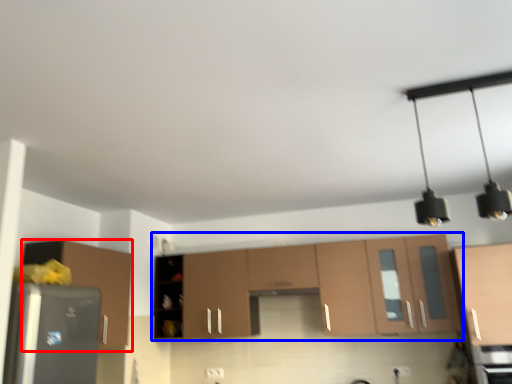
Question: Which point is closer to the camera, cabinetry (highlighted by a red box) or cabinetry (highlighted by a blue box)?

Choices:
 (A) cabinetry
 (B) cabinetry

Answer: (A)